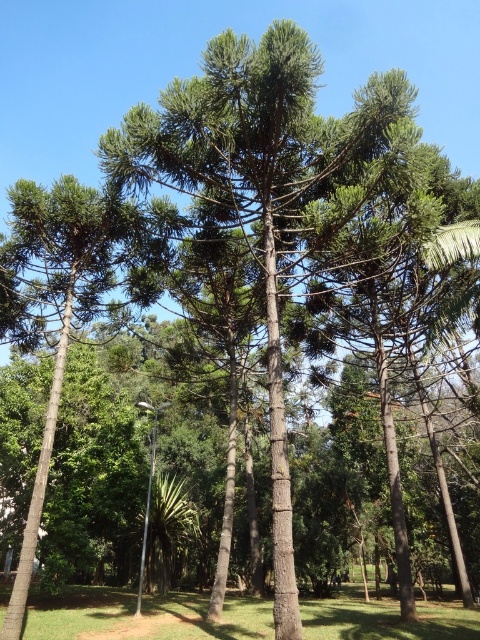
In the scene shown: You are standing at the point marked by coordinates point (60, 305) in the image. Looking around, you see a green textured pine tree at center. What is the direction of the green textured pine tree at center relative to your current position?

The green textured pine tree at center is located at the point marked by coordinates point (60, 305), so you are currently standing right at the base of the green textured pine tree at center.

You are standing in the middle of a park and see the green textured pine tree at center and the green grass at lower center. Which object is higher up in the scene?

The green textured pine tree at center is located above the green grass at lower center, so it is higher up in the scene.

You are planning to plant a new tree in your backyard. The space you have is narrow. You see the green textured pine tree at center and the green grass at lower center in the image. Which of these two would be more suitable for your narrow space?

The green textured pine tree at center has a lesser width compared to the green grass at lower center, so it would be more suitable for a narrow space.